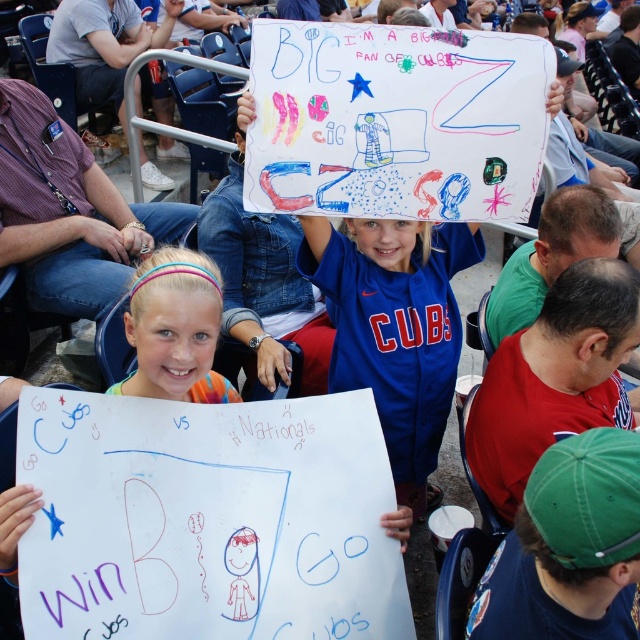
You are a photographer trying to capture a photo of both the blue jersey at center and the pastel hairband at center. Based on their positions, which object should you focus on first to ensure both are in frame?

Since the blue jersey at center is wider than the pastel hairband at center, you should focus on the blue jersey at center first to ensure both are in frame.